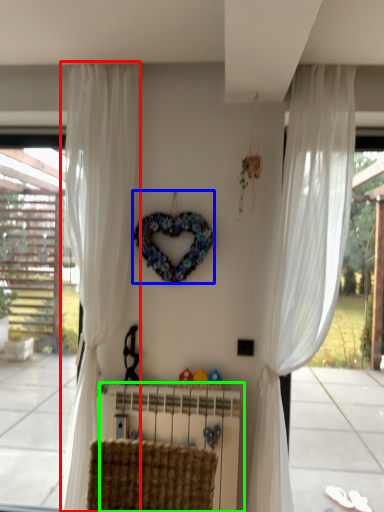
Question: Which is nearer to the curtain (highlighted by a red box)? wreath (highlighted by a blue box) or radiator (highlighted by a green box).

Choices:
 (A) wreath
 (B) radiator

Answer: (A)